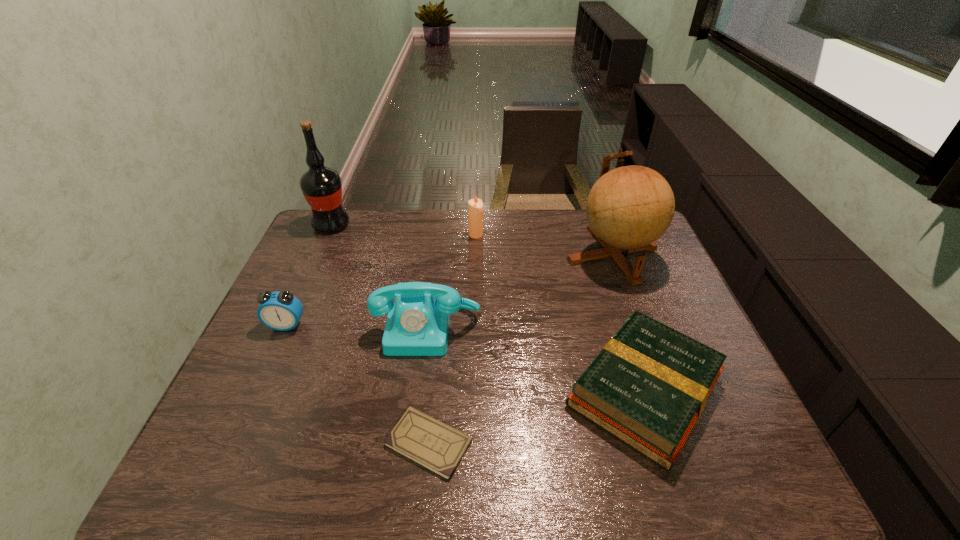
Where is `object that is the third closest to the sixth tallest object`? The image size is (960, 540). object that is the third closest to the sixth tallest object is located at coordinates click(436, 446).

Locate an element on the screen. vacant region that satisfies the following two spatial constraints: 1. on the front side of the candle; 2. on the right side of the wine bottle is located at coordinates (327, 235).

Where is `free space in the image that satisfies the following two spatial constraints: 1. on the dial of the telephone; 2. on the left side of the hardback book`? Image resolution: width=960 pixels, height=540 pixels. free space in the image that satisfies the following two spatial constraints: 1. on the dial of the telephone; 2. on the left side of the hardback book is located at coordinates (420, 390).

This screenshot has width=960, height=540. What are the coordinates of `free location that satisfies the following two spatial constraints: 1. on the front side of the wine bottle; 2. on the left side of the checkbook` in the screenshot? It's located at (234, 442).